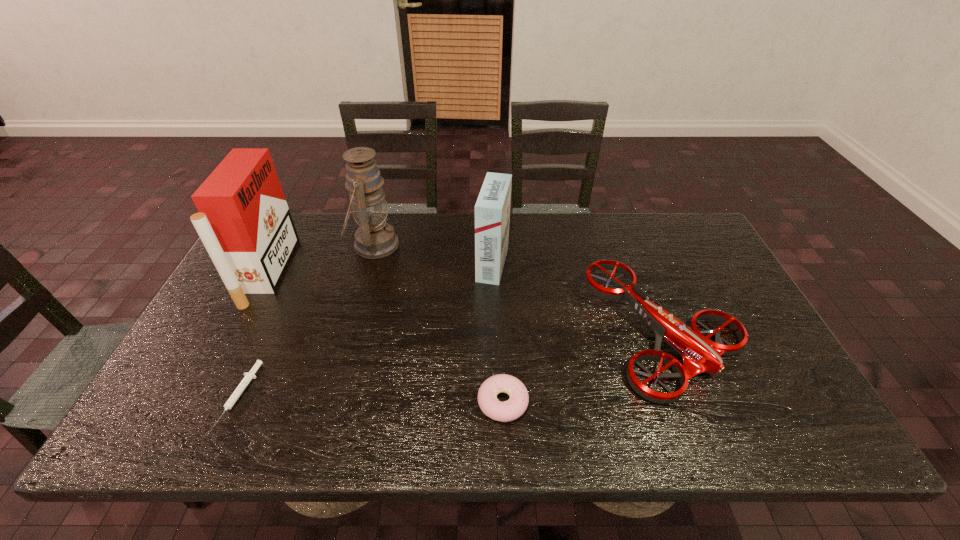
Locate an element on the screen. syringe that is at the left edge is located at coordinates (236, 394).

Locate an element on the screen. object that is positioned at the right edge is located at coordinates (699, 354).

Where is `object that is at the far left corner`? This screenshot has height=540, width=960. object that is at the far left corner is located at coordinates (244, 222).

Image resolution: width=960 pixels, height=540 pixels. Identify the location of object that is at the near left corner. (236, 394).

In the image, there is a desktop. Where is `vacant space at the far edge`? vacant space at the far edge is located at coordinates (568, 213).

Identify the location of vacant space at the near edge of the desktop. This screenshot has height=540, width=960. (645, 418).

What are the coordinates of `vacant space at the far right corner` in the screenshot? It's located at (685, 235).

In the image, there is a desktop. Identify the location of vacant space at the near right corner. (774, 418).

What are the coordinates of `free space between the taller cigarette case and the syringe` in the screenshot? It's located at (254, 333).

This screenshot has height=540, width=960. Identify the location of free space that is in between the third object from left to right and the left cigarette case. (322, 259).